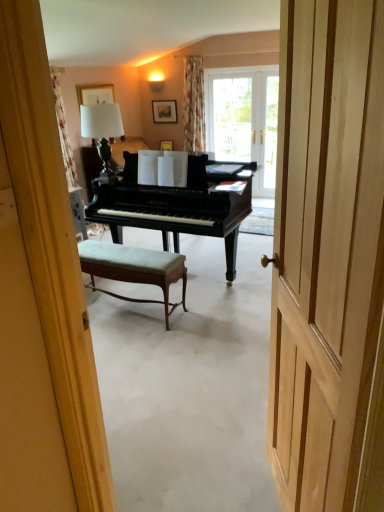
Question: Does wooden picture frame at upper center, placed as the 2th picture frame when sorted from left to right, have a larger size compared to matte wooden picture frame at upper center, the second picture frame from the back?

Choices:
 (A) no
 (B) yes

Answer: (A)

Question: Can you confirm if wooden picture frame at upper center, placed as the 2th picture frame when sorted from left to right, is thinner than matte wooden picture frame at upper center, the second picture frame from the back?

Choices:
 (A) no
 (B) yes

Answer: (B)

Question: Would you say wooden picture frame at upper center, the first picture frame when ordered from right to left, is a long distance from matte wooden picture frame at upper center, acting as the 1th picture frame starting from the left?

Choices:
 (A) yes
 (B) no

Answer: (A)

Question: From a real-world perspective, does wooden picture frame at upper center, the first picture frame when ordered from right to left, sit lower than matte wooden picture frame at upper center, the second picture frame from the back?

Choices:
 (A) no
 (B) yes

Answer: (B)

Question: Is wooden picture frame at upper center, placed as the 2th picture frame when sorted from left to right, closer to camera compared to matte wooden picture frame at upper center, the second picture frame from the back?

Choices:
 (A) yes
 (B) no

Answer: (B)

Question: Would you say white fabric lampshade at upper center is to the left or to the right of wooden picture frame at upper center, the first picture frame when ordered from right to left, in the picture?

Choices:
 (A) left
 (B) right

Answer: (A)

Question: Relative to wooden picture frame at upper center, the 2th picture frame when ordered from front to back, is white fabric lampshade at upper center in front or behind?

Choices:
 (A) behind
 (B) front

Answer: (B)

Question: In terms of size, does white fabric lampshade at upper center appear bigger or smaller than wooden picture frame at upper center, the first picture frame when ordered from right to left?

Choices:
 (A) small
 (B) big

Answer: (B)

Question: Does point (119, 110) appear closer or farther from the camera than point (165, 116)?

Choices:
 (A) closer
 (B) farther

Answer: (A)

Question: Is transparent glass door at upper center wider or thinner than wooden door at center?

Choices:
 (A) wide
 (B) thin

Answer: (A)

Question: Is transparent glass door at upper center spatially inside wooden door at center, or outside of it?

Choices:
 (A) inside
 (B) outside

Answer: (B)

Question: From a real-world perspective, relative to wooden door at center, is transparent glass door at upper center vertically above or below?

Choices:
 (A) above
 (B) below

Answer: (A)

Question: Would you say transparent glass door at upper center is to the left or to the right of wooden door at center in the picture?

Choices:
 (A) right
 (B) left

Answer: (A)

Question: From the image's perspective, is wooden door at center above or below velvet green stool at center?

Choices:
 (A) above
 (B) below

Answer: (B)

Question: Do you think wooden door at center is within velvet green stool at center, or outside of it?

Choices:
 (A) outside
 (B) inside

Answer: (A)